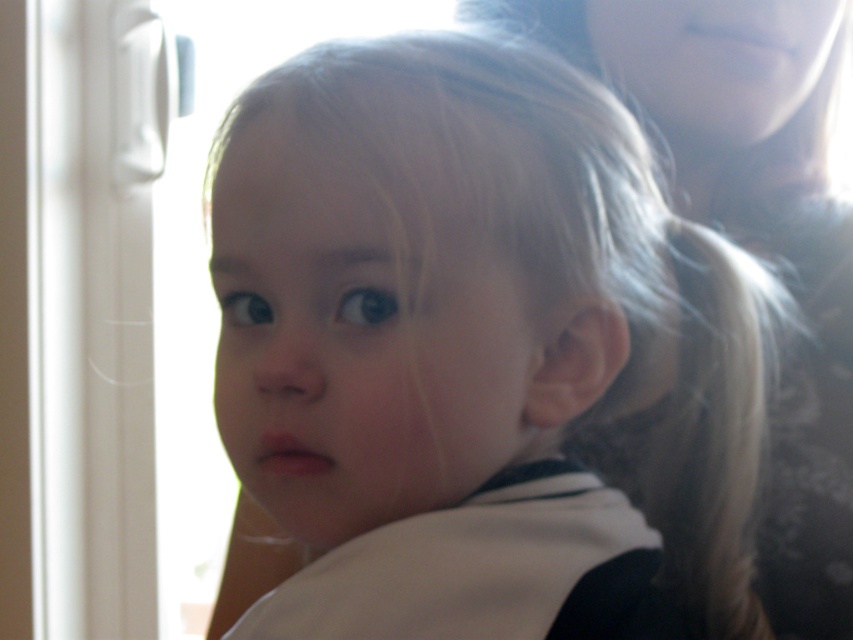
Question: Is smooth skin baby at center wider than smooth skin face at upper center?

Choices:
 (A) no
 (B) yes

Answer: (A)

Question: Can you confirm if smooth skin baby at center is thinner than smooth skin face at upper center?

Choices:
 (A) yes
 (B) no

Answer: (A)

Question: Can you confirm if smooth skin baby at center is smaller than smooth skin face at upper center?

Choices:
 (A) yes
 (B) no

Answer: (A)

Question: Which of the following is the closest to the observer?

Choices:
 (A) (784, 125)
 (B) (292, 410)

Answer: (B)